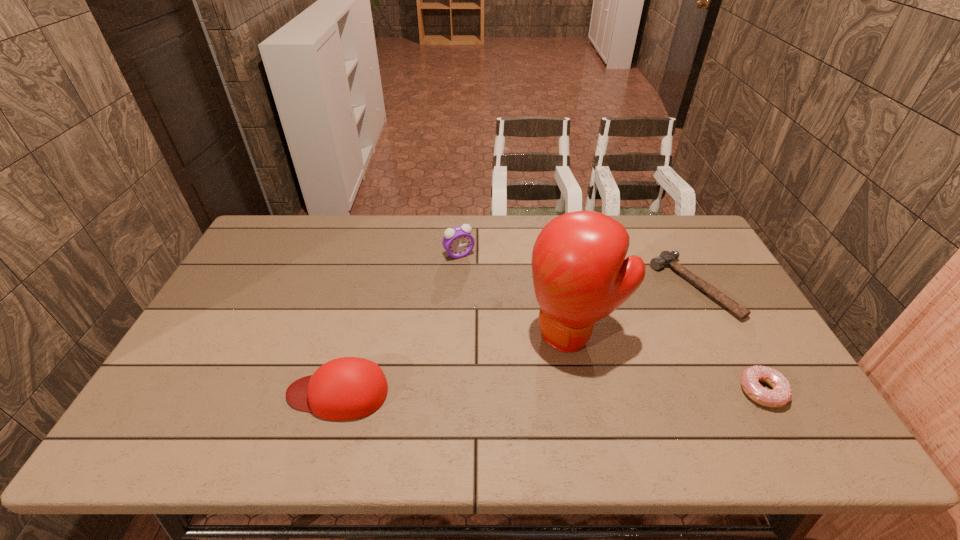
The width and height of the screenshot is (960, 540). In order to click on free space located on the face of the second object from left to right in this screenshot , I will do `click(501, 313)`.

Where is `free location located on the face of the second object from left to right`? This screenshot has width=960, height=540. free location located on the face of the second object from left to right is located at coordinates (501, 313).

At what (x,y) coordinates should I click in order to perform the action: click on vacant position located on the face of the second object from left to right. Please return your answer as a coordinate pair (x, y). The height and width of the screenshot is (540, 960). Looking at the image, I should click on (519, 340).

Identify the location of vacant region located on the striking face of the hammer. (626, 328).

Where is `vacant space located 0.050m on the striking face of the hammer`? The width and height of the screenshot is (960, 540). vacant space located 0.050m on the striking face of the hammer is located at coordinates (659, 310).

Image resolution: width=960 pixels, height=540 pixels. What are the coordinates of `blank area located on the striking face of the hammer` in the screenshot? It's located at (564, 360).

The height and width of the screenshot is (540, 960). Identify the location of free space located on the striking surface of the third object from left to right. (518, 376).

Identify the location of vacant position located 0.190m on the striking surface of the third object from left to right. (491, 400).

Image resolution: width=960 pixels, height=540 pixels. Find the location of `free space located on the striking surface of the third object from left to right`. free space located on the striking surface of the third object from left to right is located at coordinates (481, 408).

You are a GUI agent. You are given a task and a screenshot of the screen. Output one action in this format:
    pyautogui.click(x=<x>, y=<y>)
    Task: Click on the object positioned at the far edge
    This screenshot has height=540, width=960.
    Given the screenshot: What is the action you would take?
    pyautogui.click(x=458, y=242)